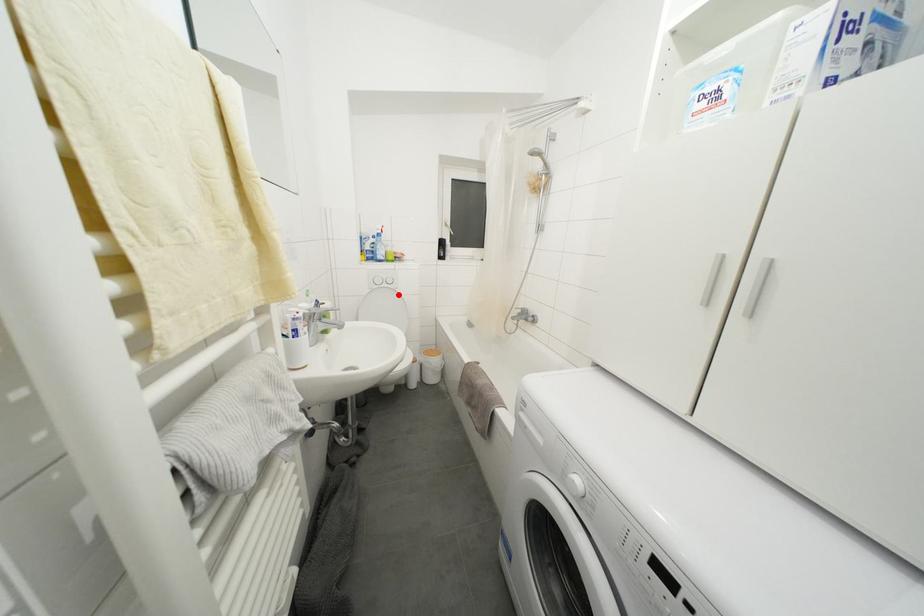
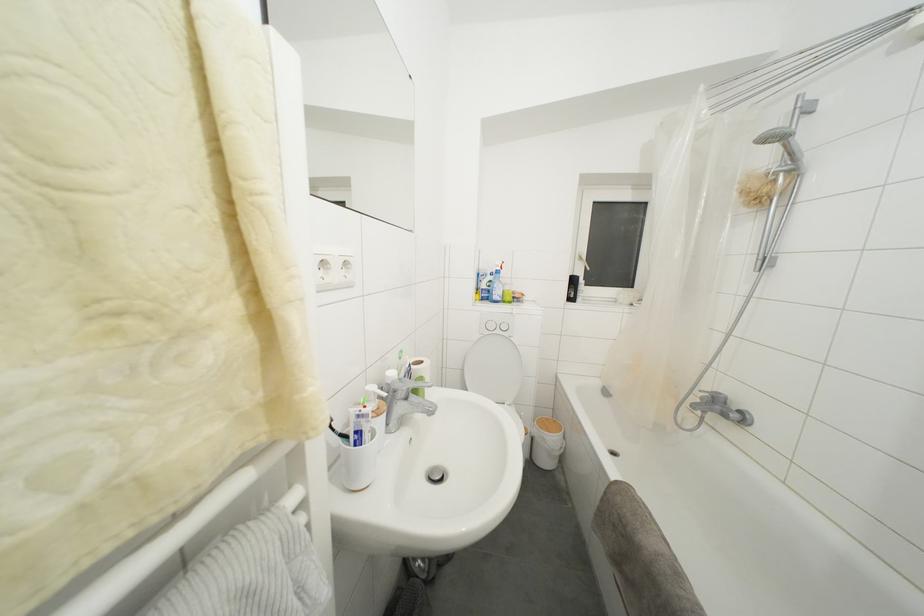
Find the pixel in the second image that matches the highlighted location in the first image.

(513, 344)